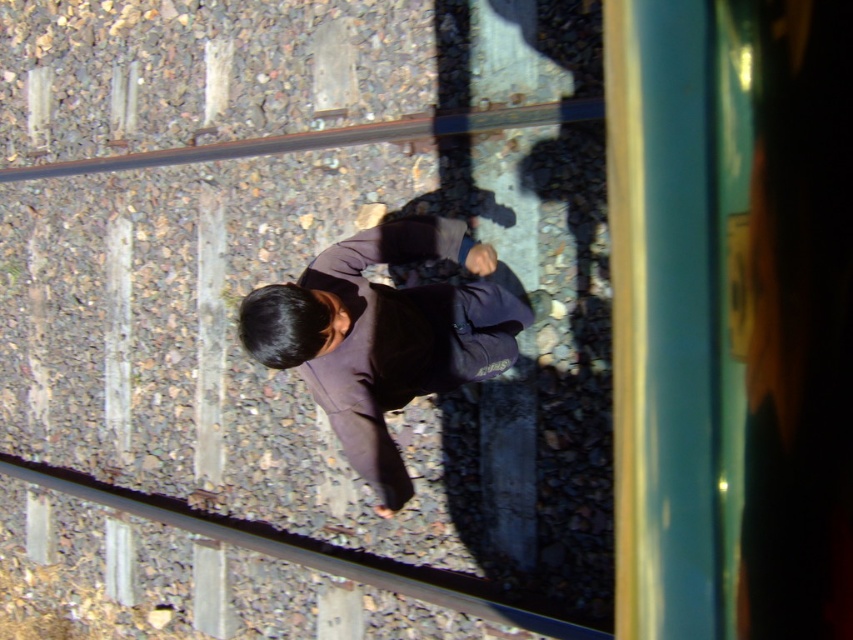
The height and width of the screenshot is (640, 853). What do you see at coordinates (387, 333) in the screenshot? I see `dark brown fabric at center` at bounding box center [387, 333].

Measure the distance between point (480, 276) and camera.

Point (480, 276) is 13.72 feet away from camera.

You are a GUI agent. You are given a task and a screenshot of the screen. Output one action in this format:
    pyautogui.click(x=<x>, y=<y>)
    Task: Click on the dark brown fabric at center
    This screenshot has height=640, width=853.
    Given the screenshot: What is the action you would take?
    pyautogui.click(x=387, y=333)

Describe the element at coordinates (289, 280) in the screenshot. Image resolution: width=853 pixels, height=640 pixels. I see `green glass train window at upper right` at that location.

Does green glass train window at upper right have a greater width compared to dark brown fabric at center?

Indeed, green glass train window at upper right has a greater width compared to dark brown fabric at center.

The height and width of the screenshot is (640, 853). In order to click on green glass train window at upper right in this screenshot , I will do `click(289, 280)`.

I want to click on green glass train window at upper right, so click(289, 280).

Who is positioned more to the right, green glass train window at upper right or rusty metal train track at upper center?

From the viewer's perspective, rusty metal train track at upper center appears more on the right side.

Is point (50, 416) behind point (403, 140)?

Yes, it is.

Identify the location of green glass train window at upper right. (289, 280).